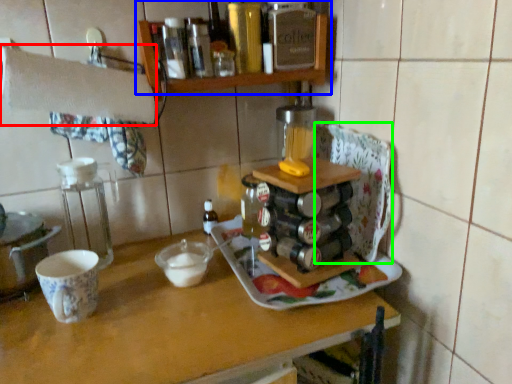
Question: Which is farther away from towel bar (highlighted by a red box)? shelf (highlighted by a blue box) or wide (highlighted by a green box)?

Choices:
 (A) shelf
 (B) wide

Answer: (B)